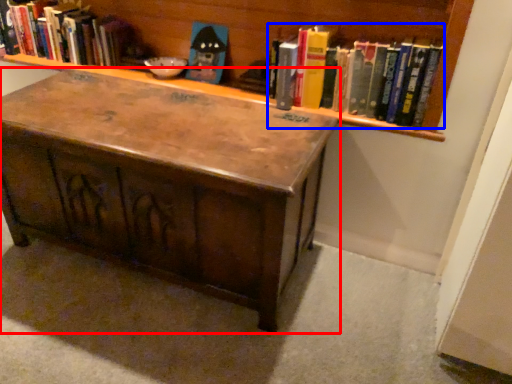
Question: Among these objects, which one is farthest to the camera, table (highlighted by a red box) or book (highlighted by a blue box)?

Choices:
 (A) table
 (B) book

Answer: (B)